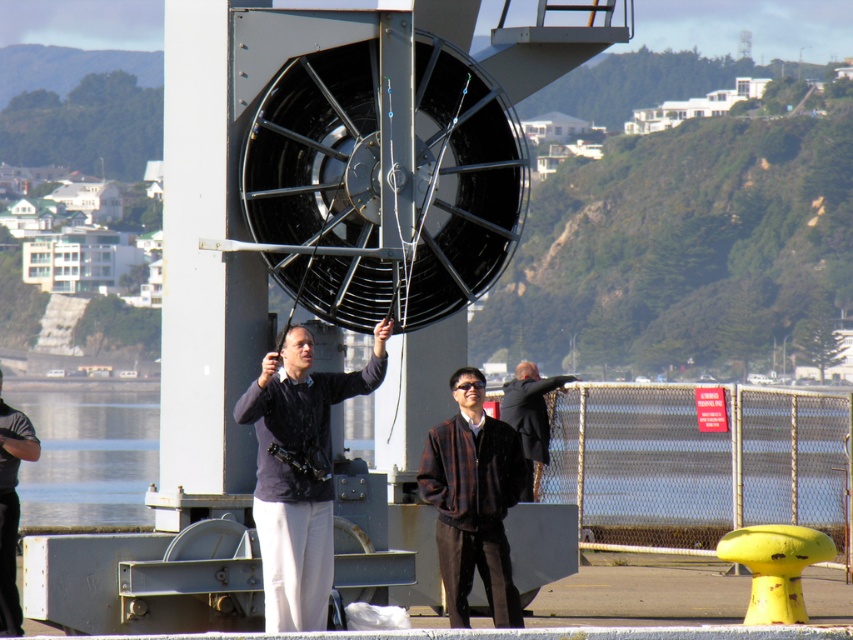
Question: Which point is closer to the camera taking this photo?

Choices:
 (A) (535, 365)
 (B) (7, 422)
 (C) (74, 426)
 (D) (440, 445)

Answer: (D)

Question: Is dark gray fabric jacket at center above clear water at lower left?

Choices:
 (A) yes
 (B) no

Answer: (A)

Question: Does clear water at lower left have a greater width compared to dark brown leather jacket at center?

Choices:
 (A) no
 (B) yes

Answer: (B)

Question: Which object is positioned farthest from the dark gray fabric jacket at center?

Choices:
 (A) clear water at lower left
 (B) dark gray fabric pants at lower left
 (C) plaid fabric jacket at center
 (D) metal mesh fence at lower right

Answer: (A)

Question: Which object appears farthest from the camera in this image?

Choices:
 (A) clear water at lower left
 (B) metal mesh fence at lower right
 (C) dark brown leather jacket at center

Answer: (A)

Question: Can you confirm if plaid fabric jacket at center is smaller than clear water at lower left?

Choices:
 (A) yes
 (B) no

Answer: (A)